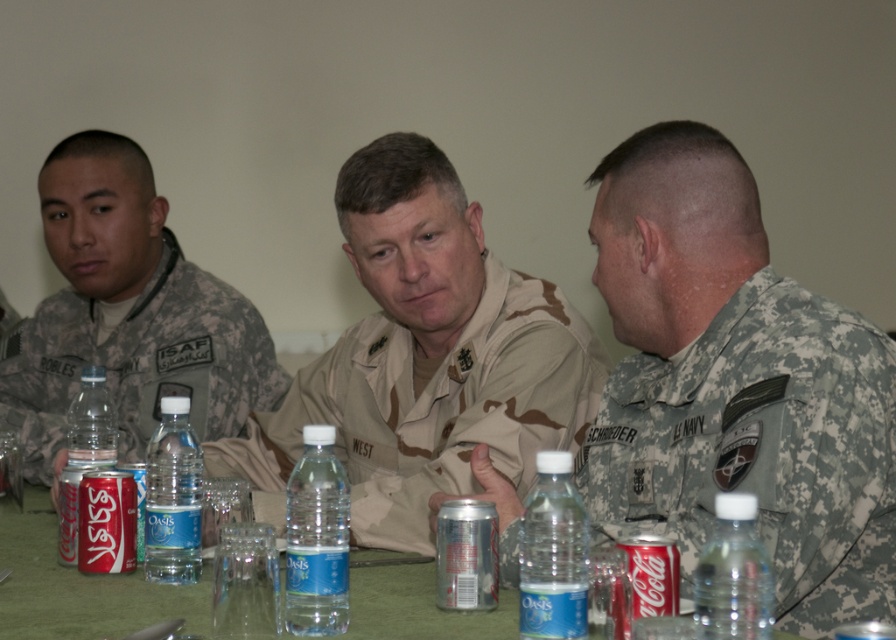
In order to click on clear glass water at center in this screenshot , I will do `click(246, 582)`.

Locate an element on the screen. clear glass water at center is located at coordinates (246, 582).

Can you confirm if camouflage uniform at center is taller than clear plastic water bottle at center?

Indeed, camouflage uniform at center has a greater height compared to clear plastic water bottle at center.

Is point (692, 323) farther from camera compared to point (345, 584)?

Yes, point (692, 323) is farther from viewer.

Is point (703, 140) farther from viewer compared to point (334, 586)?

That is True.

At what (x,y) coordinates should I click in order to perform the action: click on camouflage uniform at center. Please return your answer as a coordinate pair (x, y). The width and height of the screenshot is (896, 640). Looking at the image, I should click on (737, 385).

Can you confirm if camouflage fabric uniform at center is smaller than camouflage uniform at left?

Correct, camouflage fabric uniform at center occupies less space than camouflage uniform at left.

Does point (333, 401) come behind point (76, 227)?

No, (333, 401) is closer to viewer.

The width and height of the screenshot is (896, 640). Identify the location of camouflage fabric uniform at center. (429, 410).